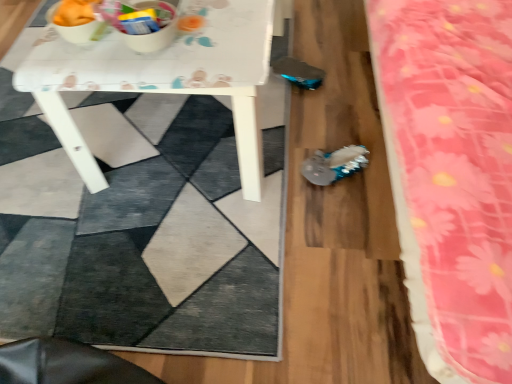
What are the coordinates of `free space underneath shiny metallic shoe at center (from a real-world perspective)` in the screenshot? It's located at (338, 170).